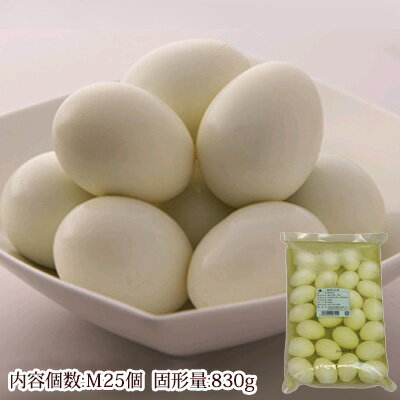
At what (x,y) coordinates should I click in order to perform the action: click on white bowl. Please return your answer as a coordinate pair (x, y). Looking at the image, I should click on (209, 326).